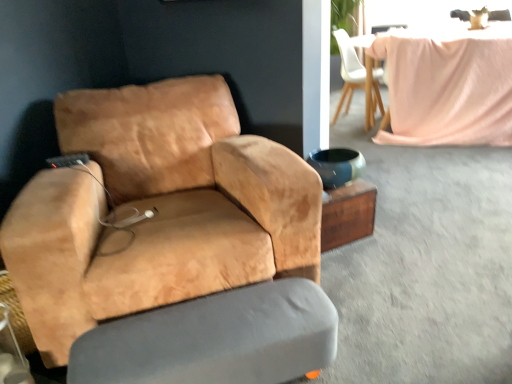
Question: Considering the positions of white matte chair at upper center, the 1th chair when ordered from back to front, and gray fabric swivel chair at lower center in the image, is white matte chair at upper center, the 1th chair when ordered from back to front, bigger or smaller than gray fabric swivel chair at lower center?

Choices:
 (A) small
 (B) big

Answer: (B)

Question: Looking at their shapes, would you say white matte chair at upper center, which appears as the 2th chair when ordered from the bottom, is wider or thinner than gray fabric swivel chair at lower center?

Choices:
 (A) wide
 (B) thin

Answer: (A)

Question: Which object is positioned farthest from the gray fabric swivel chair at lower center?

Choices:
 (A) suede tan chair at left, the second chair viewed from the right
 (B) wooden side table at center
 (C) white matte chair at upper center, the 1th chair when ordered from top to bottom

Answer: (C)

Question: Which of these objects is positioned closest to the suede tan chair at left, placed as the first chair when sorted from front to back?

Choices:
 (A) wooden side table at center
 (B) gray fabric swivel chair at lower center
 (C) white matte chair at upper center, the first chair from the right

Answer: (B)